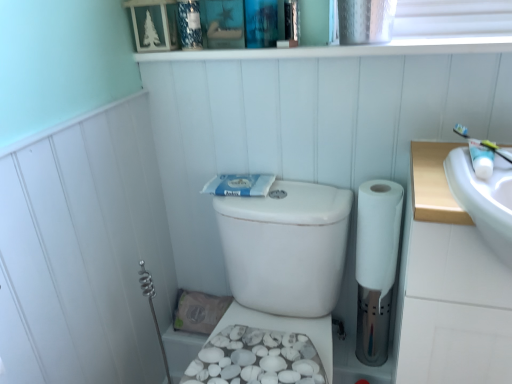
Question: Can you confirm if white textured bidet at lower center is thinner than white glossy toothpaste tube at upper right, the 2th toiletry from the back?

Choices:
 (A) no
 (B) yes

Answer: (A)

Question: Does white textured bidet at lower center have a larger size compared to white glossy toothpaste tube at upper right, the 2th toiletry from the back?

Choices:
 (A) yes
 (B) no

Answer: (A)

Question: Is white glossy toothpaste tube at upper right, the 1th toiletry in the right-to-left sequence, completely or partially inside white textured bidet at lower center?

Choices:
 (A) yes
 (B) no

Answer: (B)

Question: From the image's perspective, does white textured bidet at lower center appear lower than white glossy toothpaste tube at upper right, positioned as the first toiletry in front-to-back order?

Choices:
 (A) no
 (B) yes

Answer: (B)

Question: Is white textured bidet at lower center facing towards white glossy toothpaste tube at upper right, the 1th toiletry in the right-to-left sequence?

Choices:
 (A) no
 (B) yes

Answer: (A)

Question: Does white textured bidet at lower center have a greater height compared to white glossy toothpaste tube at upper right, positioned as the first toiletry in front-to-back order?

Choices:
 (A) no
 (B) yes

Answer: (A)

Question: Is white glossy toothpaste tube at upper right, the 2th toiletry viewed from the top, oriented away from white matte toilet paper at right?

Choices:
 (A) no
 (B) yes

Answer: (A)

Question: From the image's perspective, is white glossy toothpaste tube at upper right, placed as the second toiletry when sorted from left to right, above white matte toilet paper at right?

Choices:
 (A) yes
 (B) no

Answer: (A)

Question: Does white glossy toothpaste tube at upper right, placed as the second toiletry when sorted from left to right, have a smaller size compared to white matte toilet paper at right?

Choices:
 (A) yes
 (B) no

Answer: (A)

Question: Considering the relative positions of white glossy toothpaste tube at upper right, the 2th toiletry from the back, and white matte toilet paper at right in the image provided, is white glossy toothpaste tube at upper right, the 2th toiletry from the back, to the right of white matte toilet paper at right from the viewer's perspective?

Choices:
 (A) yes
 (B) no

Answer: (A)

Question: Is white glossy toothpaste tube at upper right, the 1th toiletry in the right-to-left sequence, thinner than white matte toilet paper at right?

Choices:
 (A) yes
 (B) no

Answer: (A)

Question: Is white glossy toothpaste tube at upper right, the 2th toiletry viewed from the top, oriented towards white matte toilet paper at right?

Choices:
 (A) yes
 (B) no

Answer: (B)

Question: From the image's perspective, is white textured bidet at lower center on top of blue matte toothpaste at center?

Choices:
 (A) yes
 (B) no

Answer: (B)